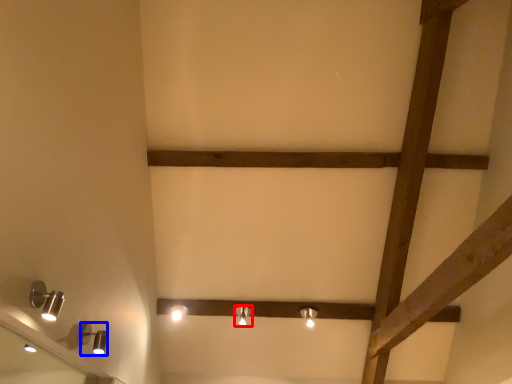
Question: Which point is further to the camera, lamp (highlighted by a red box) or lamp (highlighted by a blue box)?

Choices:
 (A) lamp
 (B) lamp

Answer: (A)